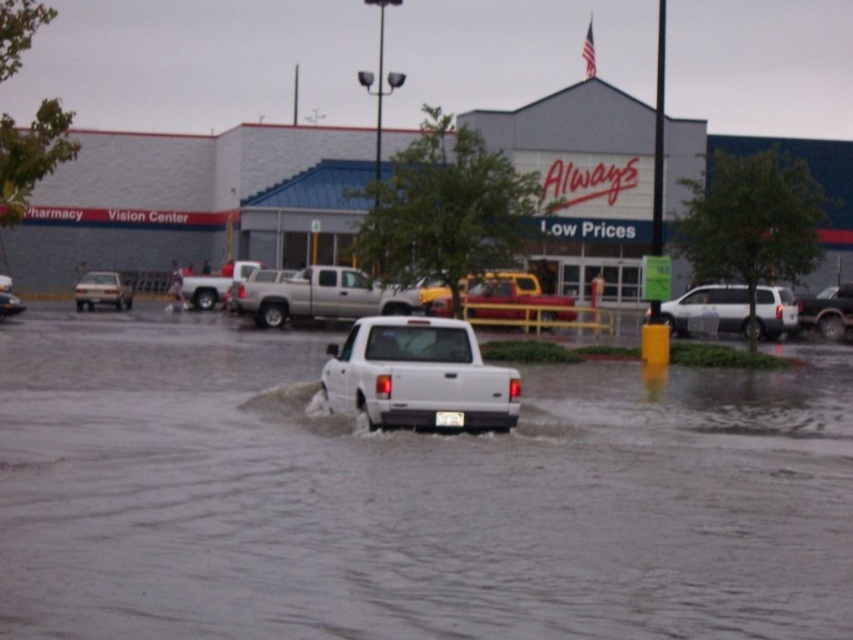
Can you confirm if white matte truck at center is positioned below matte white suv at center?

Yes, white matte truck at center is below matte white suv at center.

Can you confirm if white matte truck at center is shorter than matte white suv at center?

Indeed, white matte truck at center has a lesser height compared to matte white suv at center.

Is point (409, 392) closer to viewer compared to point (822, 307)?

Yes, it is in front of point (822, 307).

Where is `white matte truck at center`? white matte truck at center is located at coordinates point(418,376).

Looking at this image, measure the distance between white matte suv at center and camera.

white matte suv at center and camera are 46.31 meters apart from each other.

Who is higher up, white matte suv at center or white matte truck at left?

Positioned higher is white matte truck at left.

Is point (704, 301) in front of point (123, 305)?

Yes, it is in front of point (123, 305).

What are the coordinates of `white matte suv at center` in the screenshot? It's located at (709, 308).

Is point (480, 416) positioned after point (776, 305)?

No, it is not.

Is white matte truck at center positioned before white matte suv at center?

Yes, it is in front of white matte suv at center.

Is point (451, 336) farther from camera compared to point (695, 301)?

That is False.

Find the location of `white matte truck at center`. white matte truck at center is located at coordinates (418, 376).